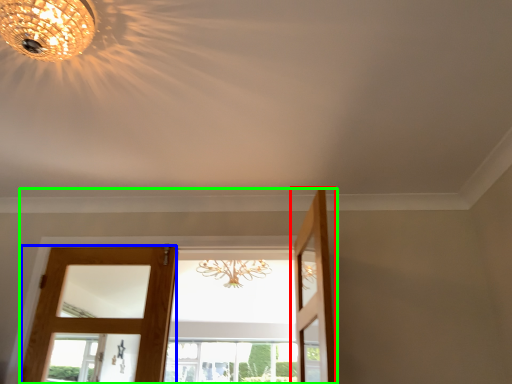
Question: Which object is positioned closest to door (highlighted by a red box)? Select from door (highlighted by a blue box) and door (highlighted by a green box).

Choices:
 (A) door
 (B) door

Answer: (B)